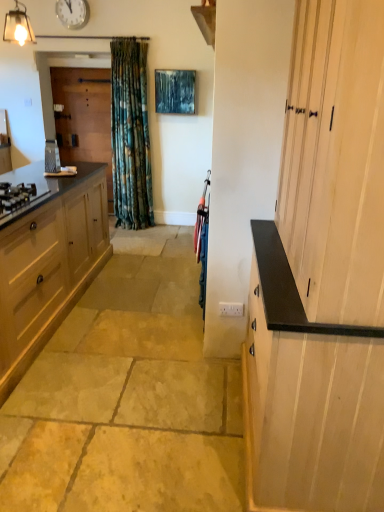
Question: Should I look upward or downward to see white glossy clock at upper center?

Choices:
 (A) down
 (B) up

Answer: (B)

Question: From a real-world perspective, is light wood cabinet at right, which is counted as the 2th cabinetry, starting from the left, on top of matte wood cabinet at left, arranged as the 2th cabinetry when viewed from the right?

Choices:
 (A) yes
 (B) no

Answer: (A)

Question: Is light wood cabinet at right, the 1th cabinetry from the right, at the left side of matte wood cabinet at left, arranged as the 2th cabinetry when viewed from the right?

Choices:
 (A) yes
 (B) no

Answer: (B)

Question: Does light wood cabinet at right, the 1th cabinetry from the right, have a greater height compared to matte wood cabinet at left, the 1th cabinetry in the left-to-right sequence?

Choices:
 (A) yes
 (B) no

Answer: (A)

Question: From the image's perspective, is light wood cabinet at right, which is counted as the 2th cabinetry, starting from the left, over matte wood cabinet at left, the 1th cabinetry in the left-to-right sequence?

Choices:
 (A) yes
 (B) no

Answer: (B)

Question: Can you confirm if light wood cabinet at right, which is counted as the 2th cabinetry, starting from the left, is shorter than matte wood cabinet at left, the 1th cabinetry in the left-to-right sequence?

Choices:
 (A) no
 (B) yes

Answer: (A)

Question: Does light wood cabinet at right, the 1th cabinetry from the right, touch matte wood cabinet at left, arranged as the 2th cabinetry when viewed from the right?

Choices:
 (A) yes
 (B) no

Answer: (B)

Question: Considering the relative sizes of matte black gas stove at left and light wood cabinet at right, the 1th cabinetry from the right, in the image provided, is matte black gas stove at left smaller than light wood cabinet at right, the 1th cabinetry from the right,?

Choices:
 (A) yes
 (B) no

Answer: (A)

Question: Can you confirm if matte black gas stove at left is thinner than light wood cabinet at right, the 1th cabinetry from the right?

Choices:
 (A) no
 (B) yes

Answer: (B)

Question: Is matte black gas stove at left behind light wood cabinet at right, the 1th cabinetry from the right?

Choices:
 (A) no
 (B) yes

Answer: (B)

Question: Is matte black gas stove at left outside light wood cabinet at right, which is counted as the 2th cabinetry, starting from the left?

Choices:
 (A) no
 (B) yes

Answer: (B)

Question: Is matte black gas stove at left taller than light wood cabinet at right, the 1th cabinetry from the right?

Choices:
 (A) no
 (B) yes

Answer: (A)

Question: Does matte black gas stove at left come in front of light wood cabinet at right, which is counted as the 2th cabinetry, starting from the left?

Choices:
 (A) no
 (B) yes

Answer: (A)

Question: Is natural stone floor at center located within matte wood cabinet at left, the 1th cabinetry in the left-to-right sequence?

Choices:
 (A) yes
 (B) no

Answer: (B)